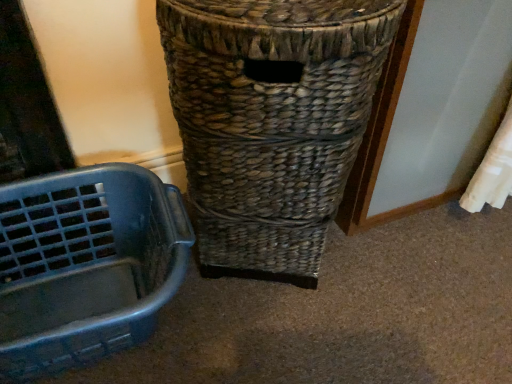
Find the location of a particular element. This screenshot has width=512, height=384. vacant area that is in front of woven brown basket at center is located at coordinates (311, 342).